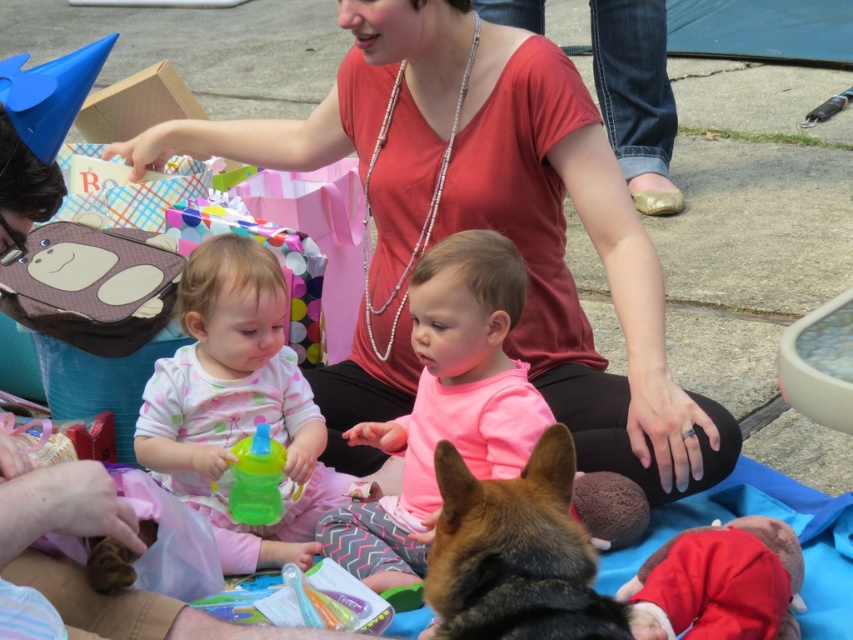
Who is shorter, pink matte shirt at center or brown fur dog at lower center?

Standing shorter between the two is brown fur dog at lower center.

In the scene shown: Between pink matte shirt at center and brown fur dog at lower center, which one is positioned higher?

pink matte shirt at center is above.

Is point (503, 259) closer to viewer compared to point (527, 614)?

No.

What are the coordinates of `pink matte shirt at center` in the screenshot? It's located at (445, 404).

Where is `brown fur dog at lower center`? The height and width of the screenshot is (640, 853). brown fur dog at lower center is located at coordinates (515, 554).

Is point (570, 566) positioned before point (247, 449)?

That is True.

I want to click on brown fur dog at lower center, so click(515, 554).

Is pink fabric dress at center shorter than translucent plastic sippy cup at center?

No.

Does pink fabric dress at center have a lesser width compared to translucent plastic sippy cup at center?

No.

Measure the distance between pink fabric dress at center and camera.

A distance of 1.89 meters exists between pink fabric dress at center and camera.

The width and height of the screenshot is (853, 640). Find the location of `pink fabric dress at center`. pink fabric dress at center is located at coordinates (236, 404).